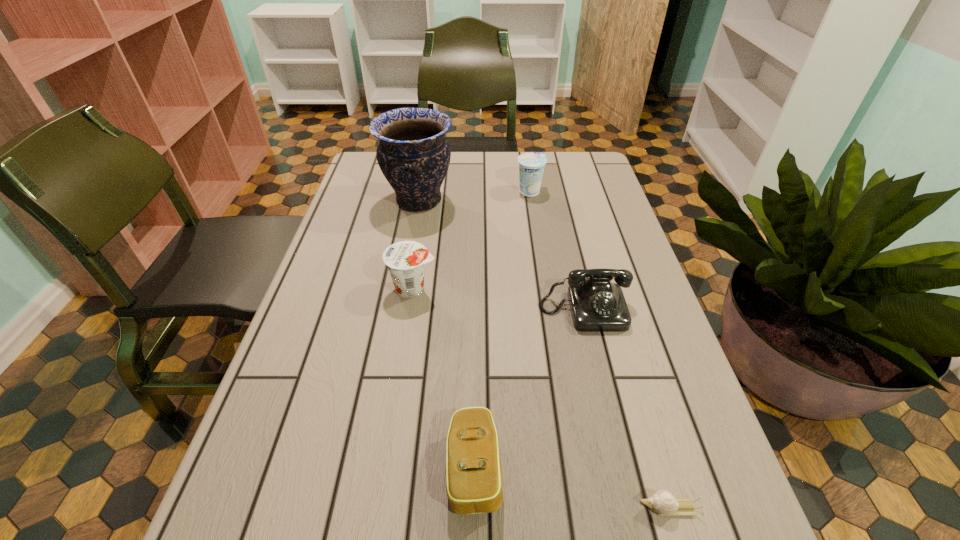
This screenshot has width=960, height=540. I want to click on the tallest object, so click(x=413, y=154).

What are the coordinates of `the farther yogurt` in the screenshot? It's located at (531, 165).

This screenshot has height=540, width=960. Identify the location of the left yogurt. (405, 260).

I want to click on telephone, so click(597, 305).

The width and height of the screenshot is (960, 540). I want to click on the third object from left to right, so click(474, 484).

The width and height of the screenshot is (960, 540). In order to click on the fifth tallest object in this screenshot , I will do `click(474, 484)`.

Find the location of a particular element. The height and width of the screenshot is (540, 960). escargot is located at coordinates (662, 502).

Image resolution: width=960 pixels, height=540 pixels. Identify the location of vacant area situated on the front handle of the tallest object. (533, 201).

Locate an element on the screen. free spot located on the right of the farther yogurt is located at coordinates (592, 192).

Where is `vacant space located on the left of the left yogurt`? This screenshot has width=960, height=540. vacant space located on the left of the left yogurt is located at coordinates click(x=309, y=289).